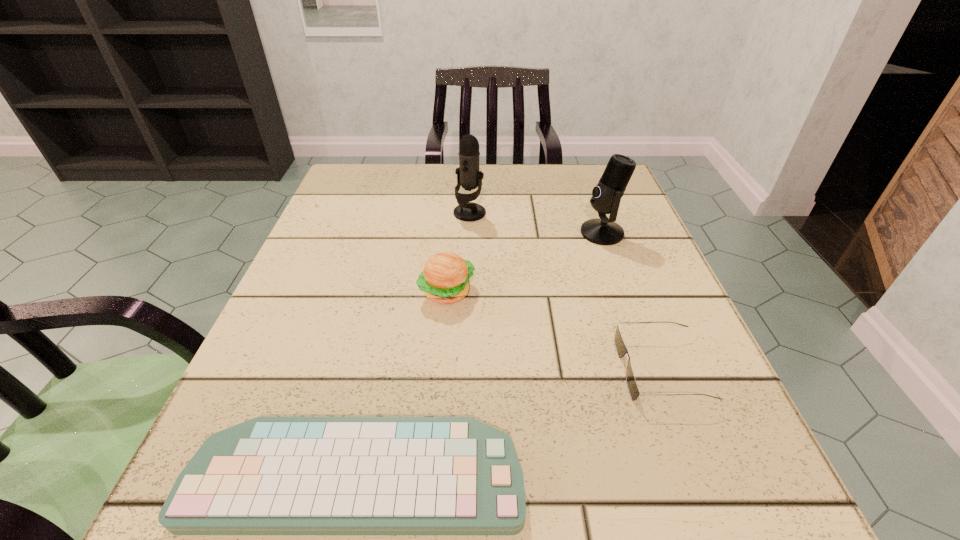
You are a GUI agent. You are given a task and a screenshot of the screen. Output one action in this format:
    pyautogui.click(x=<x>, y=<y>)
    Task: Click on the microphone situated at the right edge
    The image size is (960, 540).
    Given the screenshot: What is the action you would take?
    pyautogui.click(x=606, y=196)

Find the location of a particular element. The height and width of the screenshot is (540, 960). sunglasses located in the right edge section of the desktop is located at coordinates (621, 349).

Where is `object that is at the near left corner`? Image resolution: width=960 pixels, height=540 pixels. object that is at the near left corner is located at coordinates (269, 475).

Locate an element on the screen. free space at the far edge is located at coordinates (525, 166).

At what (x,y) coordinates should I click in order to perform the action: click on free space at the near edge of the desktop. Please return your answer as a coordinate pair (x, y). This screenshot has height=540, width=960. Looking at the image, I should click on (634, 535).

In the image, there is a desktop. Find the location of `vacant space at the left edge`. vacant space at the left edge is located at coordinates (356, 360).

You are a GUI agent. You are given a task and a screenshot of the screen. Output one action in this format:
    pyautogui.click(x=<x>, y=<y>)
    Task: Click on the vacant space at the right edge of the desktop
    
    Given the screenshot: What is the action you would take?
    pyautogui.click(x=697, y=358)

Where is `free region at the far left corner`? The image size is (960, 540). free region at the far left corner is located at coordinates coord(364,176).

At what (x,y) coordinates should I click in order to perform the action: click on free space at the far right corner of the desktop. Please return your answer as a coordinate pair (x, y). The width and height of the screenshot is (960, 540). Looking at the image, I should click on (629, 210).

Identify the location of unoccupied position between the right microphone and the second nearest object. The width and height of the screenshot is (960, 540). (632, 301).